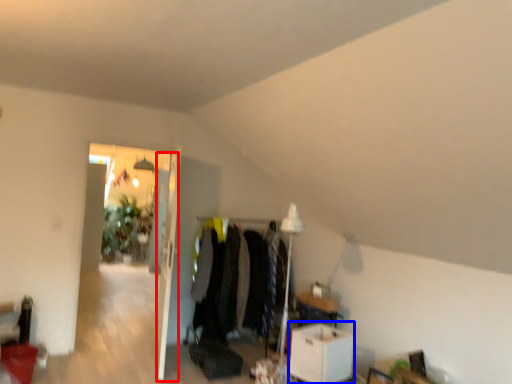
Question: Among these objects, which one is nearest to the camera, door (highlighted by a red box) or table (highlighted by a blue box)?

Choices:
 (A) door
 (B) table

Answer: (B)